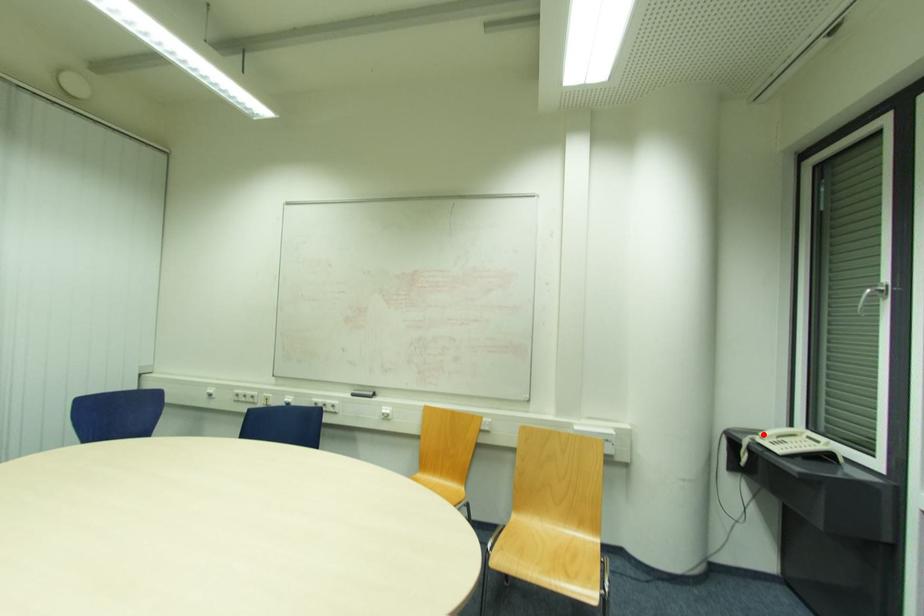
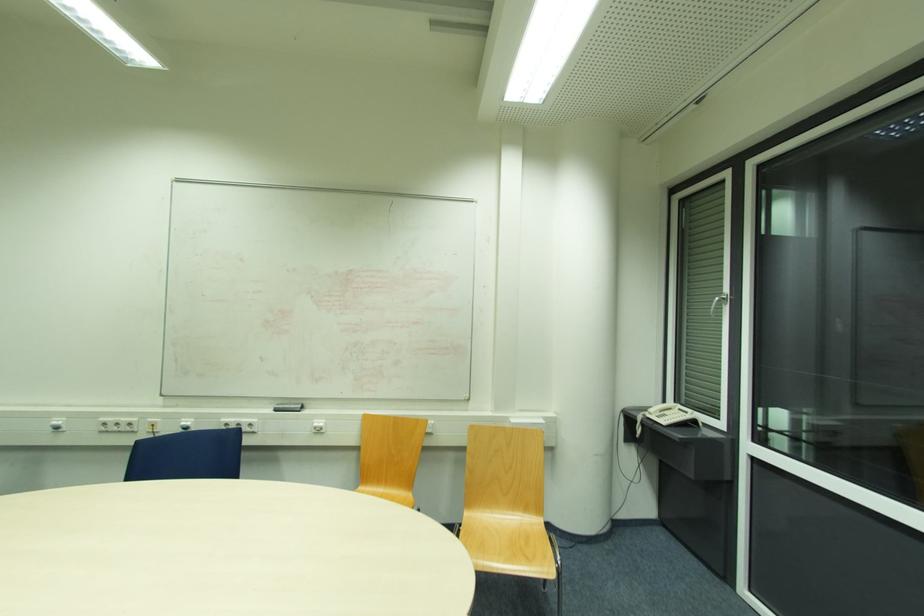
In the second image, find the point that corresponds to the highlighted location in the first image.

(652, 411)